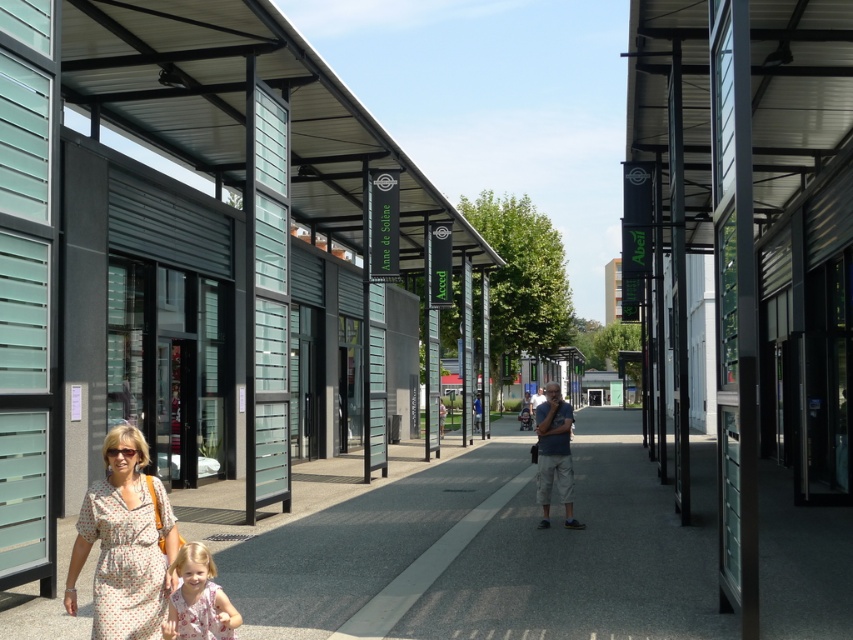
You are a fashion designer observing a pedestrian walkway scene. You notice a dotted fabric dress at lower left and a matte gray shorts at center. Which clothing item appears to be smaller in size?

The dotted fabric dress at lower left is smaller than the matte gray shorts at center.

You are a delivery person carrying a large box that requires a stable surface. You see the smooth concrete pavement at lower center and the floral dress at lower left. Which surface would be more suitable for placing your box?

The smooth concrete pavement at lower center has a larger size compared to the floral dress at lower left, so it would be more suitable for placing the large box due to its stability and sufficient space.

You are a delivery person carrying a large box that requires a sturdy surface to place it. Looking at the image, which object between the smooth concrete pavement at lower center and the dotted fabric dress at lower left would be the most appropriate to place your box?

The smooth concrete pavement at lower center has a larger size compared to the dotted fabric dress at lower left, so it is more appropriate to place the box there as it can accommodate the box better due to its size and sturdiness.